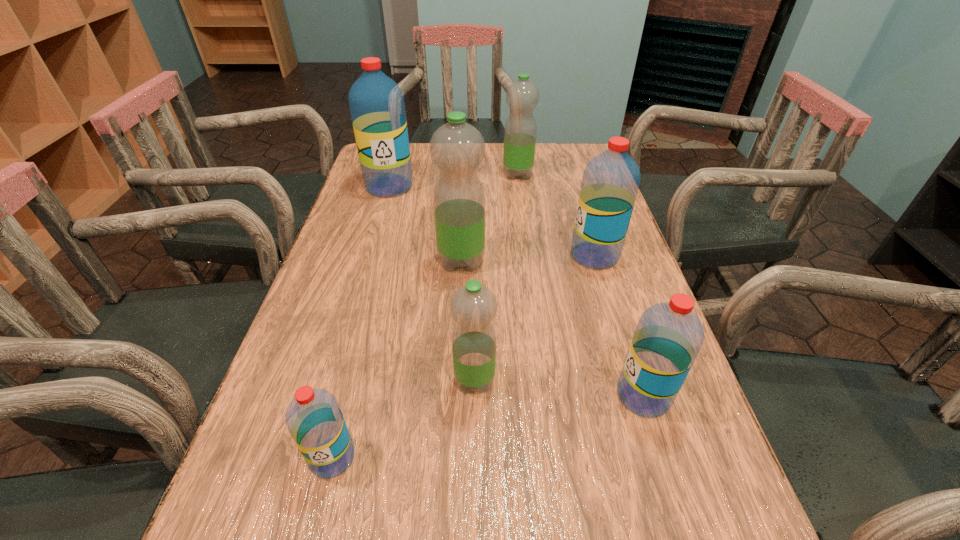
Where is `vacant area at the far edge of the desktop`? This screenshot has width=960, height=540. vacant area at the far edge of the desktop is located at coordinates (415, 174).

This screenshot has width=960, height=540. In the image, there is a desktop. What are the coordinates of `vacant space at the left edge` in the screenshot? It's located at (326, 314).

The width and height of the screenshot is (960, 540). What are the coordinates of `vacant space at the right edge of the desktop` in the screenshot? It's located at (704, 434).

In the image, there is a desktop. At what (x,y) coordinates should I click in order to perform the action: click on free space at the far right corner. Please return your answer as a coordinate pair (x, y). The width and height of the screenshot is (960, 540). Looking at the image, I should click on 545,154.

This screenshot has height=540, width=960. What are the coordinates of `vacant space in between the third biggest red water bottle and the smallest red water bottle` in the screenshot? It's located at (488, 427).

You are a GUI agent. You are given a task and a screenshot of the screen. Output one action in this format:
    pyautogui.click(x=<x>, y=<y>)
    Task: Click on the free space between the second biggest red water bottle and the second farthest green water bottle
    This screenshot has width=960, height=540.
    Given the screenshot: What is the action you would take?
    pyautogui.click(x=528, y=258)

Find the location of a particular element. free space between the nearest red water bottle and the farthest red water bottle is located at coordinates (361, 322).

You are a GUI agent. You are given a task and a screenshot of the screen. Output one action in this format:
    pyautogui.click(x=<x>, y=<y>)
    Task: Click on the vacant area between the smallest green water bottle and the nearest red water bottle
    The width and height of the screenshot is (960, 540).
    Given the screenshot: What is the action you would take?
    pyautogui.click(x=403, y=419)

This screenshot has height=540, width=960. Find the location of `vacant area that lies between the nearest green water bottle and the third farthest red water bottle`. vacant area that lies between the nearest green water bottle and the third farthest red water bottle is located at coordinates (559, 388).

Locate an element on the screen. This screenshot has width=960, height=540. empty space between the farthest red water bottle and the nearest green water bottle is located at coordinates (432, 283).